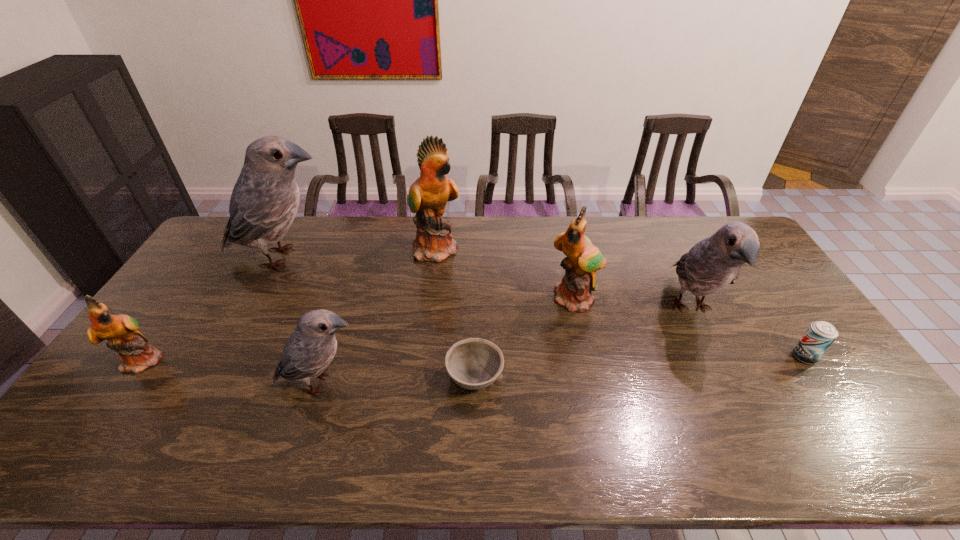
Identify the location of the farthest gray parrot. (265, 199).

This screenshot has width=960, height=540. Identify the location of the fourth parrot from left to right. (428, 195).

Image resolution: width=960 pixels, height=540 pixels. Identify the location of the farthest green parrot. (428, 195).

Where is `the rightmost green parrot`? The width and height of the screenshot is (960, 540). the rightmost green parrot is located at coordinates (583, 259).

Find the location of a particular element. This screenshot has width=960, height=540. the third object from right to left is located at coordinates (583, 259).

Locate an element on the screen. The height and width of the screenshot is (540, 960). the second object from right to left is located at coordinates 712,264.

What are the coordinates of `the second nearest gray parrot` in the screenshot? It's located at (712, 264).

Locate an element on the screen. Image resolution: width=960 pixels, height=540 pixels. the smallest green parrot is located at coordinates (121, 331).

Where is `the nearest green parrot`? the nearest green parrot is located at coordinates (121, 331).

The image size is (960, 540). Find the location of `the smallest gray parrot`. the smallest gray parrot is located at coordinates (309, 350).